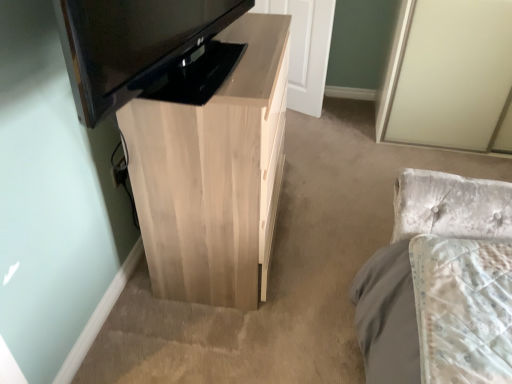
Question: Does light wood cabinet at center have a greater width compared to black glossy television at upper left?

Choices:
 (A) yes
 (B) no

Answer: (A)

Question: Is light wood cabinet at center positioned in front of black glossy television at upper left?

Choices:
 (A) yes
 (B) no

Answer: (B)

Question: From a real-world perspective, is light wood cabinet at center on black glossy television at upper left?

Choices:
 (A) no
 (B) yes

Answer: (A)

Question: Considering the relative sizes of light wood cabinet at center and black glossy television at upper left in the image provided, is light wood cabinet at center shorter than black glossy television at upper left?

Choices:
 (A) yes
 (B) no

Answer: (B)

Question: Would you say black glossy television at upper left is part of light wood cabinet at center's contents?

Choices:
 (A) yes
 (B) no

Answer: (B)

Question: Is light wood cabinet at center turned away from black glossy television at upper left?

Choices:
 (A) yes
 (B) no

Answer: (B)

Question: Does light wood cabinet at center come in front of white wood door at center?

Choices:
 (A) no
 (B) yes

Answer: (B)

Question: Does light wood cabinet at center have a lesser height compared to white wood door at center?

Choices:
 (A) no
 (B) yes

Answer: (A)

Question: Is light wood cabinet at center smaller than white wood door at center?

Choices:
 (A) no
 (B) yes

Answer: (A)

Question: Considering the relative sizes of light wood cabinet at center and white wood door at center in the image provided, is light wood cabinet at center bigger than white wood door at center?

Choices:
 (A) yes
 (B) no

Answer: (A)

Question: Does light wood cabinet at center turn towards white wood door at center?

Choices:
 (A) no
 (B) yes

Answer: (A)

Question: Would you say light wood cabinet at center is outside white wood door at center?

Choices:
 (A) no
 (B) yes

Answer: (B)

Question: Is the position of black glossy television at upper left less distant than that of white wood door at center?

Choices:
 (A) no
 (B) yes

Answer: (B)